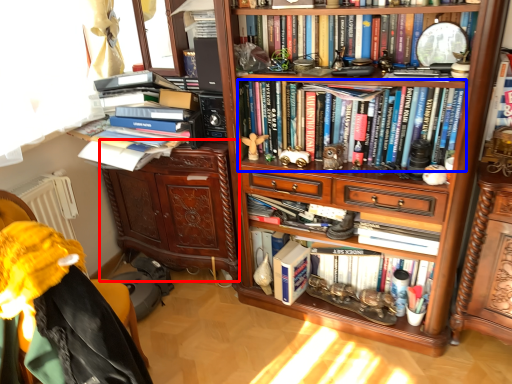
Question: Which of the following is the farthest to the observer, cabinetry (highlighted by a red box) or book (highlighted by a blue box)?

Choices:
 (A) cabinetry
 (B) book

Answer: (A)